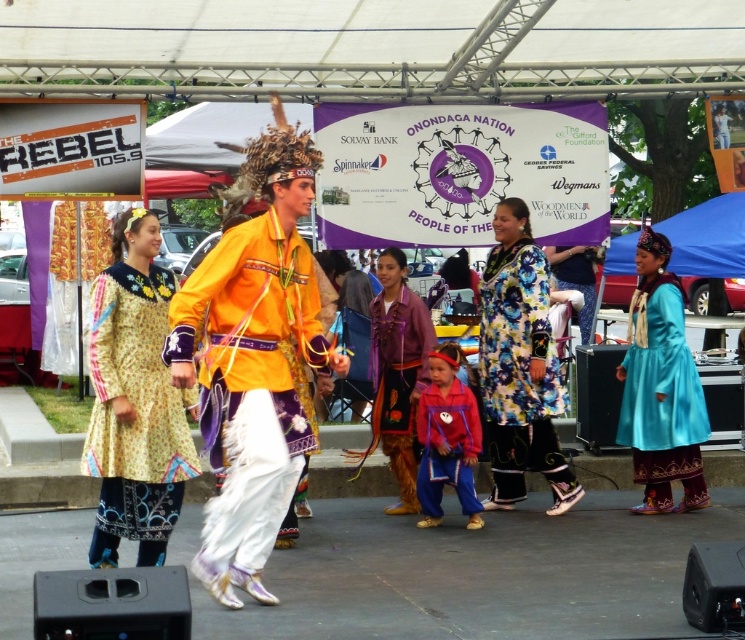
Can you confirm if matte purple dress at center is wider than matte red jacket at center?

Yes.

What do you see at coordinates (399, 371) in the screenshot? I see `matte purple dress at center` at bounding box center [399, 371].

Find the location of a particular element. This screenshot has width=745, height=640. matte purple dress at center is located at coordinates (399, 371).

Which is in front, point (209, 376) or point (691, 440)?

Positioned in front is point (209, 376).

Does yellow satin shirt at center come behind turquoise satin dress at lower right?

No, it is in front of turquoise satin dress at lower right.

At what (x,y) coordinates should I click in order to perform the action: click on yellow satin shirt at center. Please return your answer as a coordinate pair (x, y). The height and width of the screenshot is (640, 745). Looking at the image, I should click on (247, 378).

Where is `yellow satin shirt at center`? This screenshot has height=640, width=745. yellow satin shirt at center is located at coordinates (247, 378).

Does yellow satin shirt at center have a smaller size compared to matte purple dress at center?

Incorrect, yellow satin shirt at center is not smaller in size than matte purple dress at center.

Does yellow satin shirt at center have a lesser width compared to matte purple dress at center?

Incorrect, yellow satin shirt at center's width is not less than matte purple dress at center's.

What are the coordinates of `yellow satin shirt at center` in the screenshot? It's located at (247, 378).